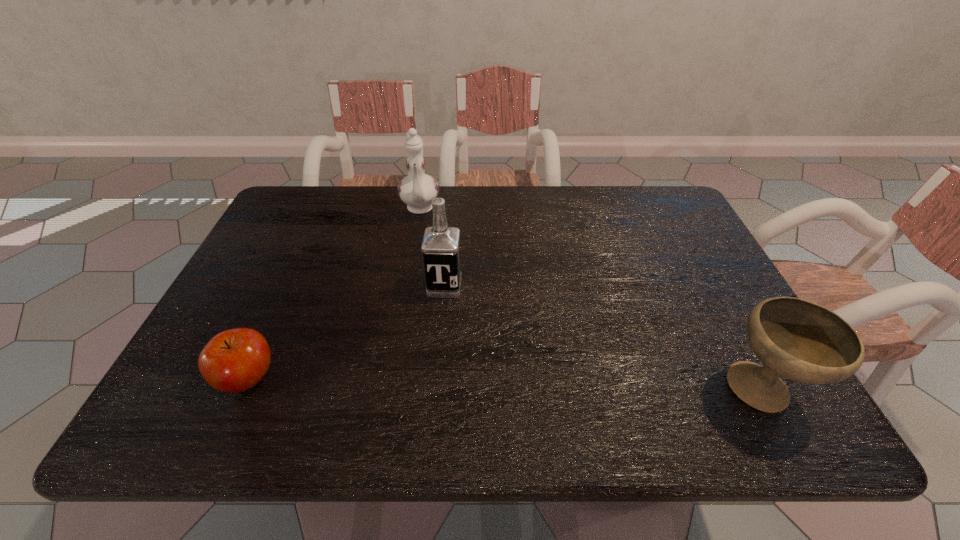
Where is `free space located 0.290m at the spout of the chinaware`? This screenshot has width=960, height=540. free space located 0.290m at the spout of the chinaware is located at coordinates (422, 294).

Identify the location of vacant space located on the front label of the vodka. (441, 314).

Identify the location of free space located on the front label of the vodka. (438, 337).

Locate an element on the screen. The image size is (960, 540). vacant area situated 0.240m on the front label of the vodka is located at coordinates pyautogui.click(x=431, y=382).

At what (x,y) coordinates should I click in order to perform the action: click on object at the far edge. Please return your answer as a coordinate pair (x, y). The image size is (960, 540). Looking at the image, I should click on (417, 190).

Find the location of a particular element. apple that is at the near edge is located at coordinates (235, 360).

Image resolution: width=960 pixels, height=540 pixels. I want to click on chalice situated at the near edge, so click(797, 339).

The height and width of the screenshot is (540, 960). Identify the location of object located in the left edge section of the desktop. (235, 360).

At what (x,y) coordinates should I click in order to perform the action: click on object that is at the right edge. Please return your answer as a coordinate pair (x, y). Image resolution: width=960 pixels, height=540 pixels. Looking at the image, I should click on (797, 339).

Where is `object present at the near left corner`? Image resolution: width=960 pixels, height=540 pixels. object present at the near left corner is located at coordinates (235, 360).